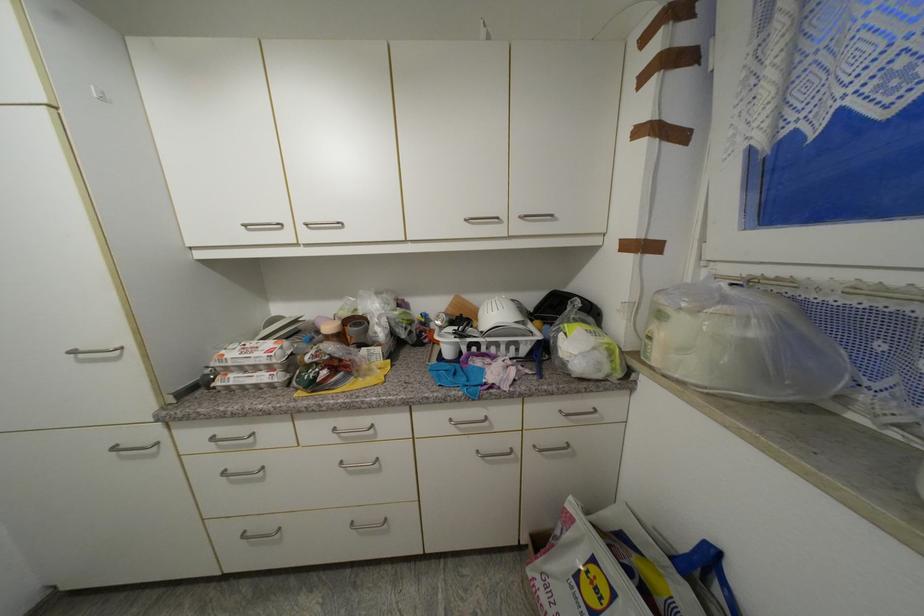
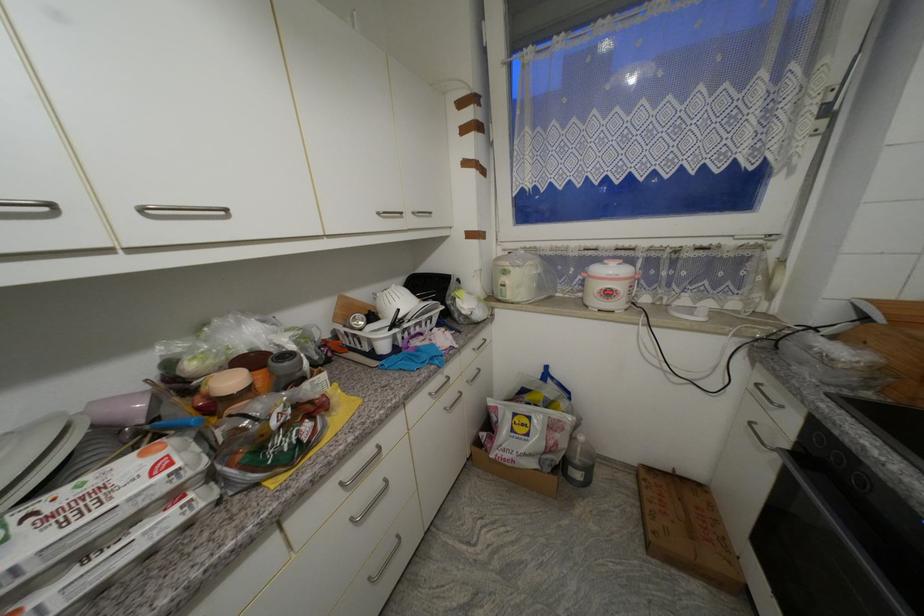
Where in the second image is the point corresponding to (275,369) from the first image?

(178, 498)